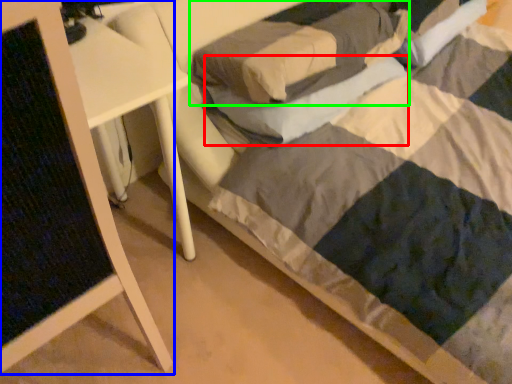
Question: Considering the real-world distances, which object is farthest from pillow (highlighted by a red box)? furniture (highlighted by a blue box) or pillow (highlighted by a green box)?

Choices:
 (A) furniture
 (B) pillow

Answer: (A)